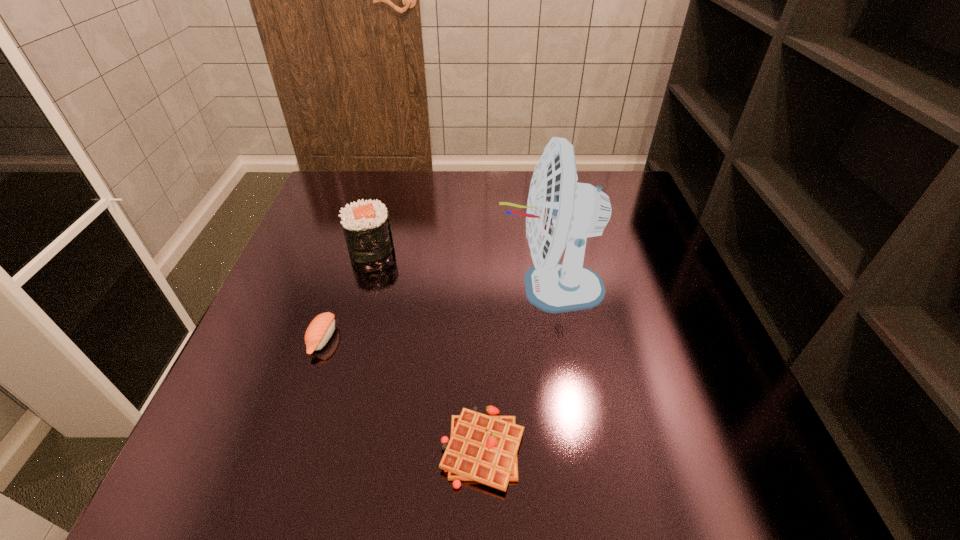
Locate an element on the screen. This screenshot has height=540, width=960. the third closest object to the taller sushi is located at coordinates (482, 448).

This screenshot has width=960, height=540. Find the location of `free location that satisfies the following two spatial constraints: 1. on the grille of the fan; 2. on the front side of the nearer sushi`. free location that satisfies the following two spatial constraints: 1. on the grille of the fan; 2. on the front side of the nearer sushi is located at coordinates (558, 339).

You are a GUI agent. You are given a task and a screenshot of the screen. Output one action in this format:
    pyautogui.click(x=<x>, y=<y>)
    Task: Click on the blank space that satisfies the following two spatial constraints: 1. on the front side of the third tallest object; 2. on the left side of the waffle
    
    Given the screenshot: What is the action you would take?
    pyautogui.click(x=286, y=449)